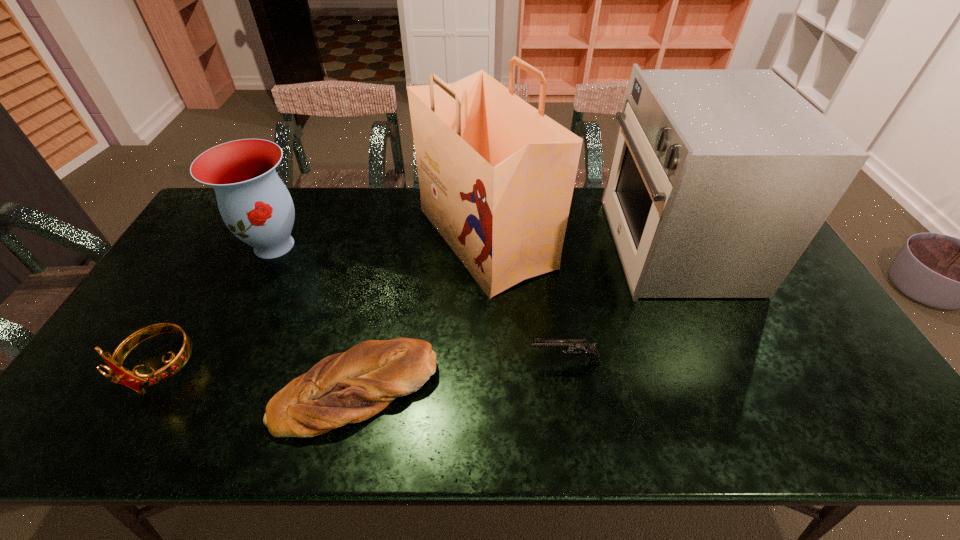
The height and width of the screenshot is (540, 960). Identify the location of grocery bag. (496, 175).

Where is `the rightmost object`? the rightmost object is located at coordinates (719, 179).

This screenshot has height=540, width=960. What are the coordinates of `vase` in the screenshot? It's located at (256, 206).

At what (x,y) coordinates should I click in order to perform the action: click on the fourth tallest object. Please return your answer as a coordinate pair (x, y). The height and width of the screenshot is (540, 960). Looking at the image, I should click on (119, 374).

In order to click on gun in this screenshot , I will do (577, 347).

This screenshot has height=540, width=960. I want to click on bread, so (x=350, y=387).

This screenshot has width=960, height=540. Identify the location of vacant space located 0.110m on the side of the grocery bag with the superhero design. (383, 238).

Where is `free space located on the side of the grocery bag with the superhero design`? The width and height of the screenshot is (960, 540). free space located on the side of the grocery bag with the superhero design is located at coordinates (328, 238).

Identify the location of vacant space located on the side of the grocery bag with the superhero design. (307, 238).

The image size is (960, 540). I want to click on vacant region located on the front panel of the rightmost object, so click(x=495, y=245).